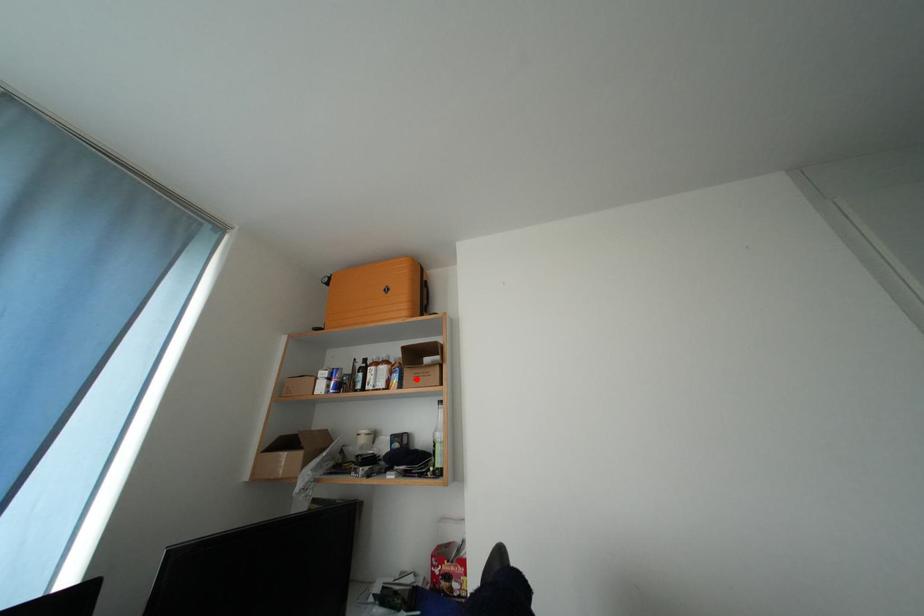
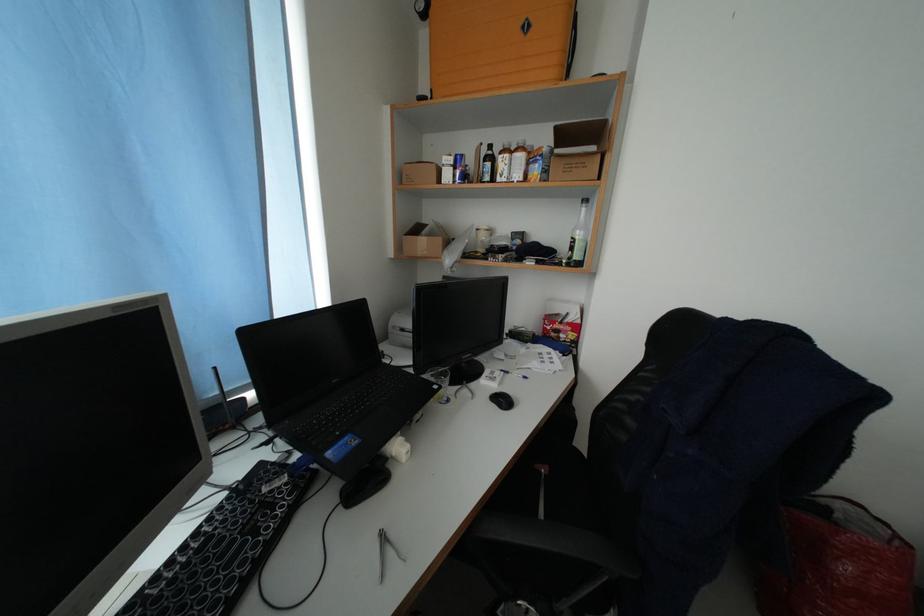
Question: I am providing you with two images of the same scene from different viewpoints. Given a red point in image1, look at the same physical point in image2. Is it:

Choices:
 (A) Closer to the viewpoint
 (B) Farther from the viewpoint

Answer: (A)